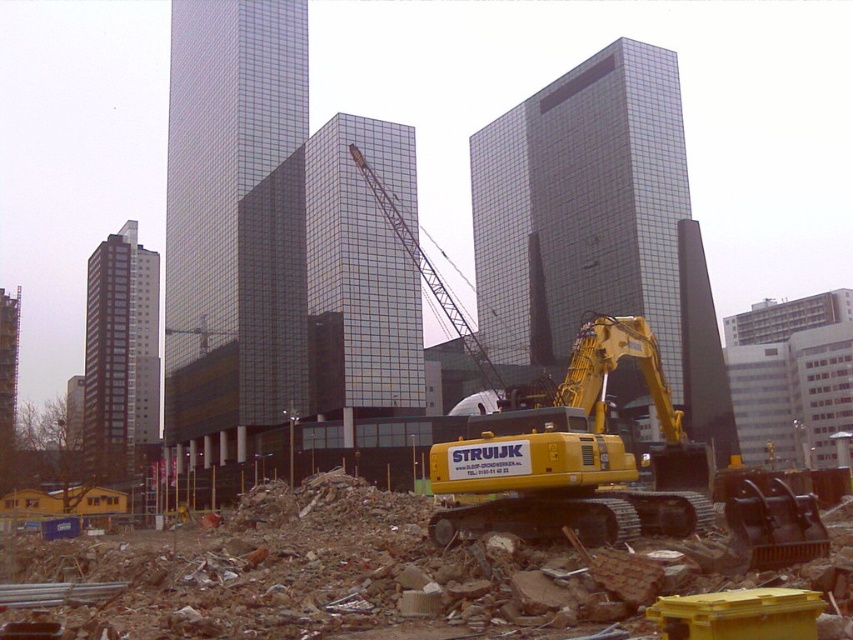
Which is above, yellow metallic excavator at center or metallic yellow crane at center?

metallic yellow crane at center is above.

Can you confirm if yellow metallic excavator at center is smaller than metallic yellow crane at center?

Yes.

Is point (555, 525) behind point (468, 348)?

That is False.

The height and width of the screenshot is (640, 853). What are the coordinates of `yellow metallic excavator at center` in the screenshot? It's located at (573, 456).

Who is more forward, (473, 614) or (616, 500)?

Positioned in front is point (473, 614).

Is yellow rubber tracked excavator at center below yellow metallic excavator at center?

Indeed, yellow rubber tracked excavator at center is positioned under yellow metallic excavator at center.

Which is in front, point (228, 509) or point (589, 458)?

Point (589, 458) is in front.

The image size is (853, 640). In order to click on yellow rubber tracked excavator at center in this screenshot , I will do `click(289, 572)`.

Find the location of `yellow rubber tracked excavator at center`. yellow rubber tracked excavator at center is located at coordinates (289, 572).

Does yellow rubber tracked excavator at center have a lesser width compared to metallic yellow crane at center?

In fact, yellow rubber tracked excavator at center might be wider than metallic yellow crane at center.

The width and height of the screenshot is (853, 640). What are the coordinates of `yellow rubber tracked excavator at center` in the screenshot? It's located at (289, 572).